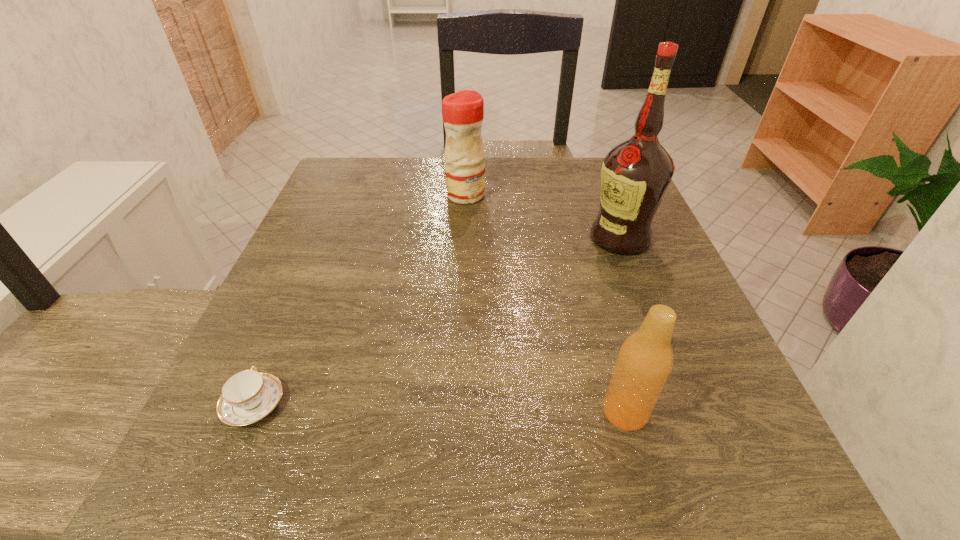
At what (x,y) coordinates should I click in order to perform the action: click on the third nearest object. Please return your answer as a coordinate pair (x, y). Image resolution: width=960 pixels, height=540 pixels. Looking at the image, I should click on (635, 175).

This screenshot has width=960, height=540. Identify the location of alcohol. (635, 175).

Locate an element on the screen. This screenshot has height=540, width=960. the third shortest object is located at coordinates (462, 112).

Where is `condiment`? This screenshot has width=960, height=540. condiment is located at coordinates (462, 112).

Find the location of a particular element. The width and height of the screenshot is (960, 540). the second shortest object is located at coordinates (645, 360).

The height and width of the screenshot is (540, 960). In order to click on teacup in this screenshot , I will do `click(248, 396)`.

The image size is (960, 540). I want to click on the leftmost object, so click(x=248, y=396).

Where is `vacant region located 0.200m on the label of the alcohol`? Image resolution: width=960 pixels, height=540 pixels. vacant region located 0.200m on the label of the alcohol is located at coordinates (494, 238).

The height and width of the screenshot is (540, 960). What are the coordinates of `vacant region located on the label of the alcohol` in the screenshot? It's located at (399, 238).

This screenshot has height=540, width=960. What are the coordinates of `vacant space located on the label of the alcohol` in the screenshot? It's located at (399, 238).